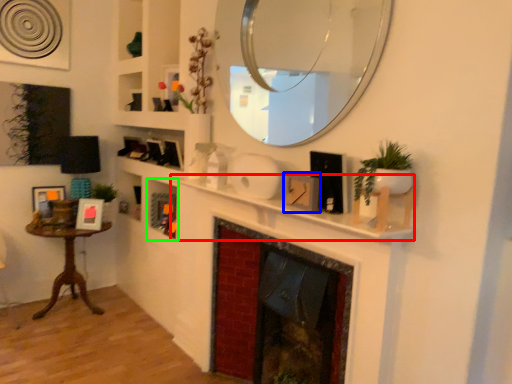
Question: Based on their relative distances, which object is nearer to mantle (highlighted by a red box)? Choose from picture frame (highlighted by a blue box) and cabinet (highlighted by a green box).

Choices:
 (A) picture frame
 (B) cabinet

Answer: (A)